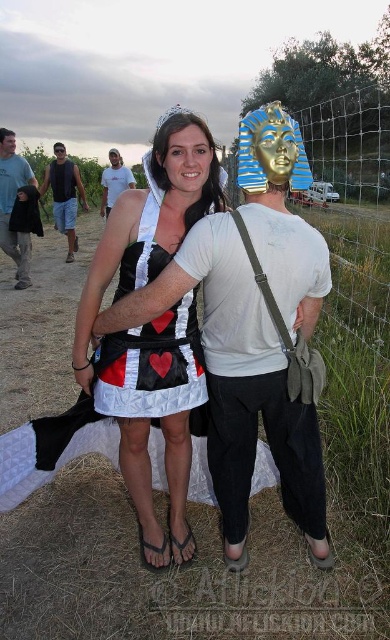
You are a photographer trying to capture a clear shot of both the brushed metal water at bottle left and the matte black tank top at left. Since you want to ensure both are in focus, you need to know which object is taller. Can you tell me which one is taller?

The brushed metal water at bottle left is much taller than the matte black tank top at left, so you should adjust your camera settings to account for the height difference to ensure both are in focus.

You are a photographer trying to capture a clear shot of both the brushed metal water at bottle left and the matte black tank top at left. Given that your camera can only focus on objects within a 40cm width limit, will both items fit within the frame?

The brushed metal water at bottle left is wider than the matte black tank top at left. Since the camera can only focus on objects within a 40cm width limit, you need to check if the total width of both items combined is under 40cm. However, the description only states the relative widths, not their exact measurements. Without specific dimensions, it is impossible to determine if they will fit within the frame.

You are organizing a costume party and need to arrange two costumes side by side. The quilted fabric dress at center and the matte black tank top at left are both on display. Which costume takes up more horizontal space when displayed?

The quilted fabric dress at center takes up more horizontal space because its width surpasses that of the matte black tank top at left.